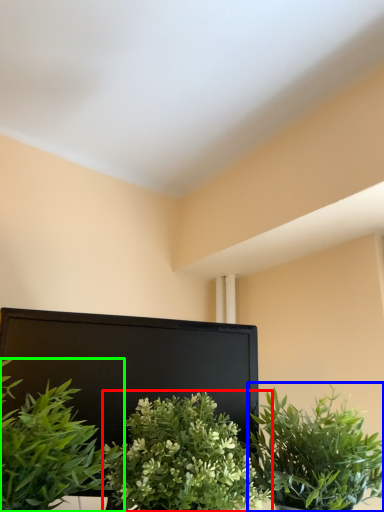
Question: Which object is positioned closest to houseplant (highlighted by a red box)? Select from houseplant (highlighted by a blue box) and houseplant (highlighted by a green box).

Choices:
 (A) houseplant
 (B) houseplant

Answer: (B)